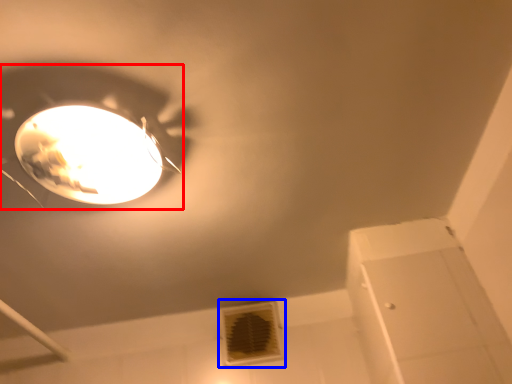
Question: Which of the following is the farthest to the observer, lamp (highlighted by a red box) or air conditioning (highlighted by a blue box)?

Choices:
 (A) lamp
 (B) air conditioning

Answer: (B)